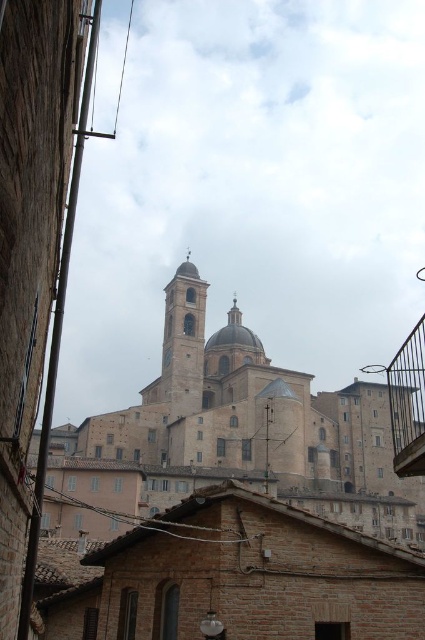
Between smooth stone tower at center and metallic balcony at lower right, which one appears on the right side from the viewer's perspective?

From the viewer's perspective, metallic balcony at lower right appears more on the right side.

Who is positioned more to the left, smooth stone tower at center or metallic balcony at lower right?

smooth stone tower at center is more to the left.

This screenshot has width=425, height=640. Describe the element at coordinates (184, 340) in the screenshot. I see `smooth stone tower at center` at that location.

The width and height of the screenshot is (425, 640). In order to click on smooth stone tower at center in this screenshot , I will do `click(184, 340)`.